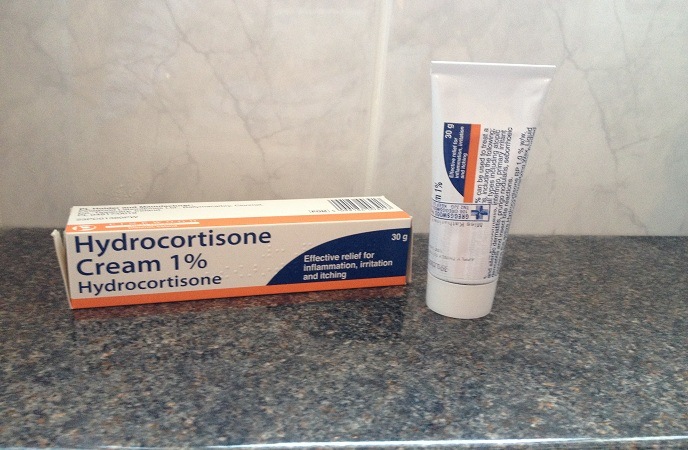
Find the location of a particular element. The height and width of the screenshot is (450, 688). counter is located at coordinates (426, 375).